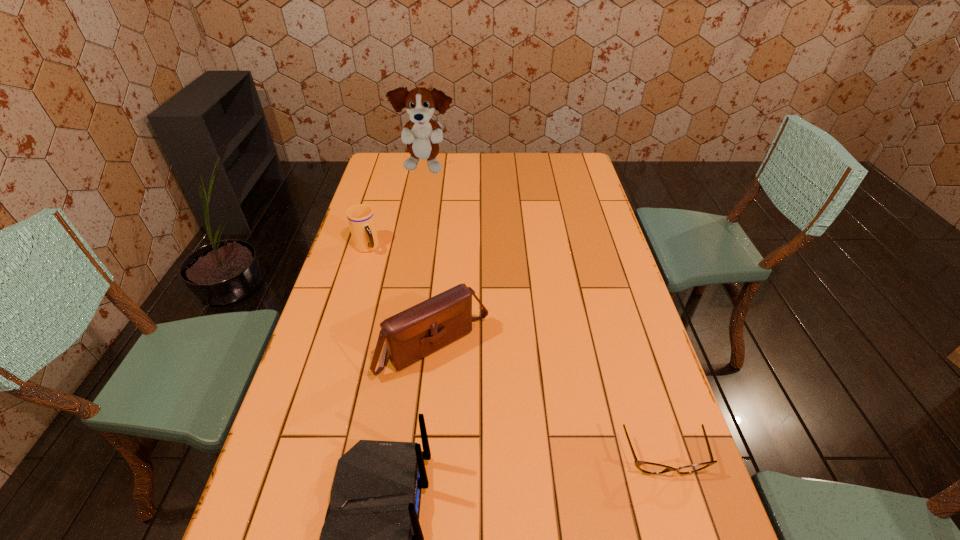
Find the location of a particular element. free space located 0.230m on the front flap of the shoulder bag is located at coordinates tap(524, 445).

Where is `vacant position located on the front flap of the shoulder bag`? The image size is (960, 540). vacant position located on the front flap of the shoulder bag is located at coordinates click(x=524, y=445).

Locate an element on the screen. free space located 0.370m on the side of the fourth nearest object with the handle is located at coordinates (421, 328).

Image resolution: width=960 pixels, height=540 pixels. I want to click on vacant region located 0.080m on the side of the fourth nearest object with the handle, so click(x=380, y=270).

At what (x,y) coordinates should I click in order to perform the action: click on free space located 0.390m on the side of the fourth nearest object with the handle. Please return your answer as a coordinate pair (x, y). Image resolution: width=960 pixels, height=540 pixels. Looking at the image, I should click on (424, 333).

This screenshot has height=540, width=960. I want to click on vacant space located 0.350m on the face of the tallest object, so click(x=445, y=232).

Locate an element on the screen. This screenshot has height=540, width=960. vacant region located 0.140m on the face of the tallest object is located at coordinates (436, 201).

Where is `free region located on the face of the tallest object`? This screenshot has height=540, width=960. free region located on the face of the tallest object is located at coordinates (439, 209).

At what (x,y) coordinates should I click in order to perform the action: click on object present at the far edge. Please return your answer as a coordinate pair (x, y). Looking at the image, I should click on tap(421, 134).

This screenshot has height=540, width=960. In order to click on cup that is positioned at the left edge in this screenshot , I will do `click(361, 220)`.